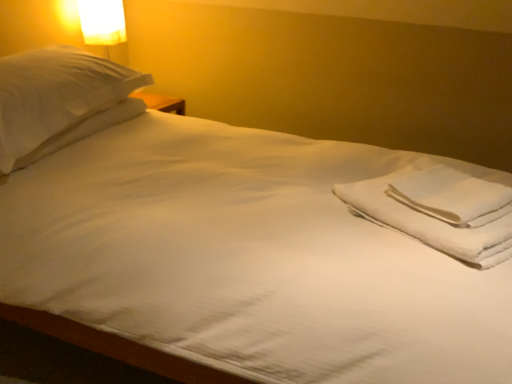
Question: From the image's perspective, is white soft towel at right located above or below white cotton towels at right?

Choices:
 (A) above
 (B) below

Answer: (A)

Question: Would you say white soft towel at right is to the left or to the right of white cotton towels at right in the picture?

Choices:
 (A) right
 (B) left

Answer: (A)

Question: Estimate the real-world distances between objects in this image. Which object is closer to the white soft towel at right?

Choices:
 (A) matte white lampshade at upper left
 (B) white soft pillow at upper left
 (C) white cotton towels at right

Answer: (C)

Question: Estimate the real-world distances between objects in this image. Which object is closer to the white soft towel at right?

Choices:
 (A) white cotton towels at right
 (B) matte white lampshade at upper left
 (C) white soft pillow at upper left

Answer: (A)